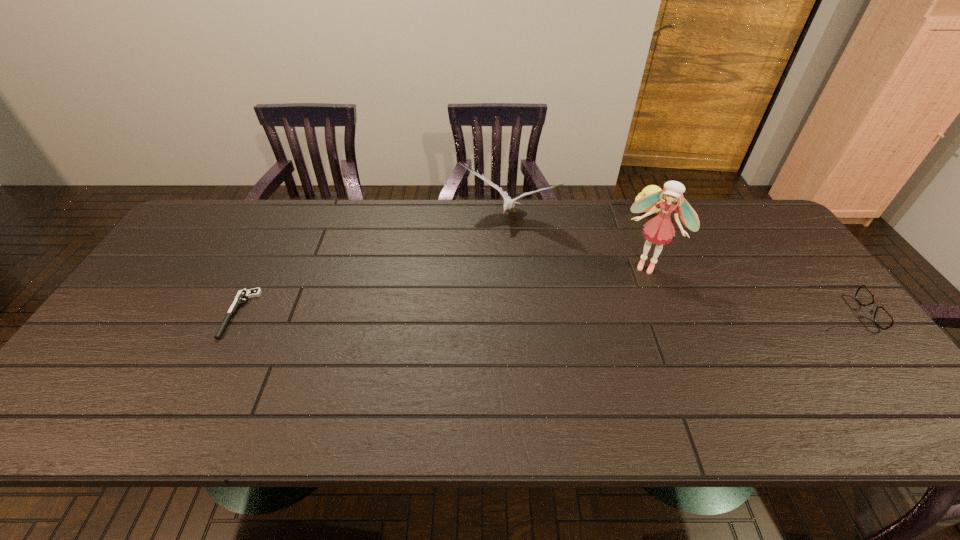
This screenshot has width=960, height=540. What are the coordinates of `free space on the desktop that is between the leftmost object and the sunglasses and is positioned on the front-facing side of the tallest object` in the screenshot? It's located at (626, 314).

Locate an element on the screen. Image resolution: width=960 pixels, height=540 pixels. vacant spot on the desktop that is between the pistol and the rightmost object and is positioned at the tip of the beak of the gull is located at coordinates (456, 314).

The image size is (960, 540). I want to click on vacant space on the desktop that is between the shortest object and the fourth tallest object and is positioned at the beak of the third tallest object, so click(x=612, y=314).